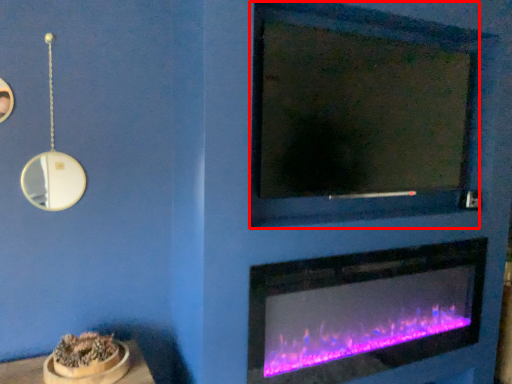
Question: From the image's perspective, considering the relative positions of mirror (annotated by the red box) and fireplace in the image provided, where is mirror (annotated by the red box) located with respect to the staircase?

Choices:
 (A) below
 (B) above

Answer: (B)